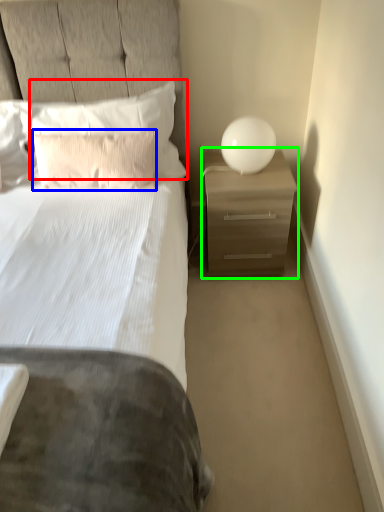
Question: Which object is positioned farthest from pillow (highlighted by a red box)? Select from pillow (highlighted by a blue box) and nightstand (highlighted by a green box).

Choices:
 (A) pillow
 (B) nightstand

Answer: (B)